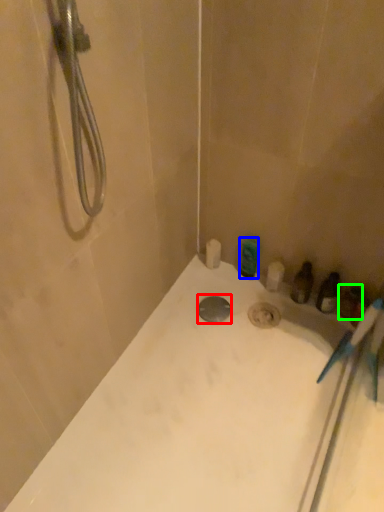
Question: Which object is the closest to the drain (highlighted by a red box)? Choose among these: toiletry (highlighted by a blue box) or toiletry (highlighted by a green box).

Choices:
 (A) toiletry
 (B) toiletry

Answer: (A)